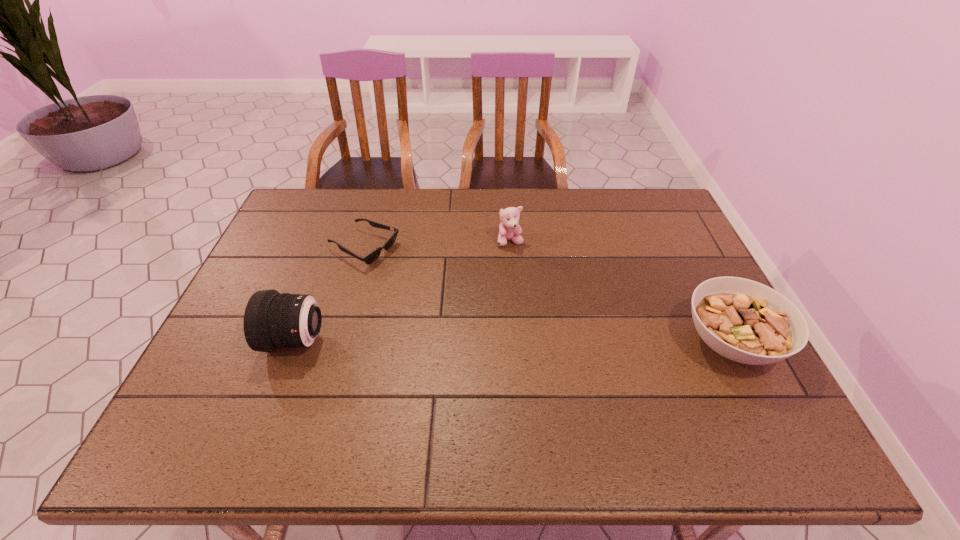
This screenshot has height=540, width=960. I want to click on free region located on the front-facing side of the shortest object, so click(491, 305).

Identify the location of vacant space located 0.200m on the front-facing side of the shortest object. Image resolution: width=960 pixels, height=540 pixels. (447, 285).

Find the location of a particular element. The height and width of the screenshot is (540, 960). object at the far edge is located at coordinates (373, 255).

Where is `object that is at the near edge`? object that is at the near edge is located at coordinates (745, 321).

Find the location of a particular element. object at the left edge is located at coordinates (272, 320).

Where is `object at the right edge`? This screenshot has width=960, height=540. object at the right edge is located at coordinates (745, 321).

Where is `object situated at the near right corner`? This screenshot has width=960, height=540. object situated at the near right corner is located at coordinates (745, 321).

In order to click on vacant space at the far edge in this screenshot , I will do `click(541, 197)`.

In order to click on free space at the near edge in this screenshot , I will do `click(483, 397)`.

In the image, there is a desktop. Where is `vacant space at the far right corner`? This screenshot has height=540, width=960. vacant space at the far right corner is located at coordinates (666, 197).